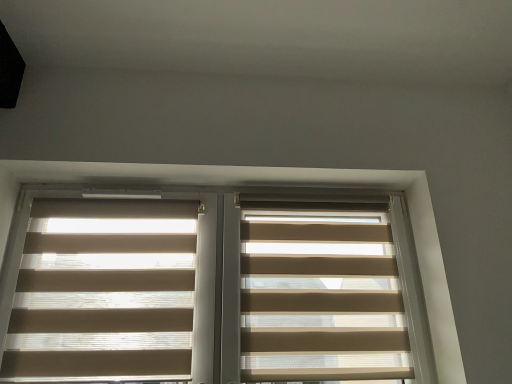
The width and height of the screenshot is (512, 384). What do you see at coordinates (103, 292) in the screenshot?
I see `beige translucent blinds at left, positioned as the 1th window blind in left-to-right order` at bounding box center [103, 292].

This screenshot has height=384, width=512. I want to click on beige translucent blinds at left, acting as the second window blind starting from the right, so click(103, 292).

Describe the element at coordinates (320, 294) in the screenshot. I see `beige fabric blinds at center, marked as the 2th window blind in a left-to-right arrangement` at that location.

This screenshot has width=512, height=384. Describe the element at coordinates (210, 288) in the screenshot. I see `beige translucent blinds at center` at that location.

At what (x,y) coordinates should I click in order to perform the action: click on beige translucent blinds at left, positioned as the 1th window blind in left-to-right order. Please return your answer as a coordinate pair (x, y). Image resolution: width=512 pixels, height=384 pixels. Looking at the image, I should click on (103, 292).

Consider the image. Is beige translucent blinds at left, positioned as the 1th window blind in left-to-right order, taller than beige translucent blinds at center?

No, beige translucent blinds at left, positioned as the 1th window blind in left-to-right order, is not taller than beige translucent blinds at center.

Can you tell me how much beige translucent blinds at left, positioned as the 1th window blind in left-to-right order, and beige translucent blinds at center differ in facing direction?

The facing directions of beige translucent blinds at left, positioned as the 1th window blind in left-to-right order, and beige translucent blinds at center are 1.68 degrees apart.

The width and height of the screenshot is (512, 384). What are the coordinates of `window blind that is the 1st one when counting downward from the beige translucent blinds at center (from the image's perspective)` in the screenshot? It's located at (103, 292).

Looking at their sizes, would you say beige translucent blinds at left, acting as the second window blind starting from the right, is wider or thinner than beige translucent blinds at center?

In the image, beige translucent blinds at left, acting as the second window blind starting from the right, appears to be more narrow than beige translucent blinds at center.

Is beige translucent blinds at left, positioned as the 1th window blind in left-to-right order, closer to camera compared to beige fabric blinds at center, marked as the 2th window blind in a left-to-right arrangement?

Yes, beige translucent blinds at left, positioned as the 1th window blind in left-to-right order, is closer to the viewer.

Is point (188, 252) more distant than point (365, 228)?

No, it is in front of (365, 228).

Based on the photo, what's the angular difference between beige translucent blinds at left, acting as the second window blind starting from the right, and beige fabric blinds at center, the first window blind in the right-to-left sequence,'s facing directions?

They differ by 0.00105 degrees in their facing directions.

Which is more to the left, beige translucent blinds at left, acting as the second window blind starting from the right, or beige fabric blinds at center, the first window blind in the right-to-left sequence?

beige translucent blinds at left, acting as the second window blind starting from the right, is more to the left.

Looking at their sizes, would you say beige translucent blinds at center is wider or thinner than beige fabric blinds at center, the first window blind in the right-to-left sequence?

beige translucent blinds at center is wider than beige fabric blinds at center, the first window blind in the right-to-left sequence.

Would you say beige translucent blinds at center contains beige fabric blinds at center, the first window blind in the right-to-left sequence?

That's correct, beige fabric blinds at center, the first window blind in the right-to-left sequence, is inside beige translucent blinds at center.

Are beige translucent blinds at center and beige fabric blinds at center, the first window blind in the right-to-left sequence, beside each other?

beige translucent blinds at center and beige fabric blinds at center, the first window blind in the right-to-left sequence, are clearly separated.

Which object is positioned more to the right, beige translucent blinds at center or beige fabric blinds at center, the first window blind in the right-to-left sequence?

beige fabric blinds at center, the first window blind in the right-to-left sequence, is more to the right.

Between point (385, 303) and point (86, 326), which one is positioned behind?

The point (385, 303) is behind.

Is beige translucent blinds at left, positioned as the 1th window blind in left-to-right order, located within beige fabric blinds at center, the first window blind in the right-to-left sequence?

That's incorrect, beige translucent blinds at left, positioned as the 1th window blind in left-to-right order, is not inside beige fabric blinds at center, the first window blind in the right-to-left sequence.

From the image's perspective, which object appears higher, beige fabric blinds at center, the first window blind in the right-to-left sequence, or beige translucent blinds at left, positioned as the 1th window blind in left-to-right order?

beige translucent blinds at left, positioned as the 1th window blind in left-to-right order, appears higher in the image.

Considering the positions of objects beige translucent blinds at center and beige translucent blinds at left, positioned as the 1th window blind in left-to-right order, in the image provided, who is behind, beige translucent blinds at center or beige translucent blinds at left, positioned as the 1th window blind in left-to-right order,?

beige translucent blinds at left, positioned as the 1th window blind in left-to-right order.

Which is correct: beige translucent blinds at center is inside beige translucent blinds at left, positioned as the 1th window blind in left-to-right order, or outside of it?

beige translucent blinds at center is outside beige translucent blinds at left, positioned as the 1th window blind in left-to-right order.

Consider the image. How different are the orientations of beige translucent blinds at center and beige translucent blinds at left, positioned as the 1th window blind in left-to-right order, in degrees?

1.68 degrees.

Which object is wider, beige translucent blinds at center or beige translucent blinds at left, positioned as the 1th window blind in left-to-right order?

beige translucent blinds at center is wider.

From the image's perspective, which is above, beige fabric blinds at center, the first window blind in the right-to-left sequence, or beige translucent blinds at center?

beige translucent blinds at center appears higher in the image.

Does beige fabric blinds at center, the first window blind in the right-to-left sequence, have a greater width compared to beige translucent blinds at center?

Incorrect, the width of beige fabric blinds at center, the first window blind in the right-to-left sequence, does not surpass that of beige translucent blinds at center.

Is beige fabric blinds at center, marked as the 2th window blind in a left-to-right arrangement, smaller than beige translucent blinds at center?

Indeed, beige fabric blinds at center, marked as the 2th window blind in a left-to-right arrangement, has a smaller size compared to beige translucent blinds at center.

Does beige fabric blinds at center, marked as the 2th window blind in a left-to-right arrangement, touch beige translucent blinds at center?

No, beige fabric blinds at center, marked as the 2th window blind in a left-to-right arrangement, is not with beige translucent blinds at center.

At what (x,y) coordinates should I click in order to perform the action: click on window blind that is the 1st object located below the beige translucent blinds at center (from the image's perspective). Please return your answer as a coordinate pair (x, y). Image resolution: width=512 pixels, height=384 pixels. Looking at the image, I should click on (103, 292).

You are a GUI agent. You are given a task and a screenshot of the screen. Output one action in this format:
    pyautogui.click(x=<x>, y=<y>)
    Task: Click on the window blind that is on the left side of beige fabric blinds at center, marked as the 2th window blind in a left-to-right arrangement
    The height and width of the screenshot is (384, 512).
    Given the screenshot: What is the action you would take?
    pyautogui.click(x=103, y=292)

Which object lies further to the anchor point beige translucent blinds at left, positioned as the 1th window blind in left-to-right order, beige fabric blinds at center, marked as the 2th window blind in a left-to-right arrangement, or beige translucent blinds at center?

beige fabric blinds at center, marked as the 2th window blind in a left-to-right arrangement, is positioned further to the anchor beige translucent blinds at left, positioned as the 1th window blind in left-to-right order.

When comparing their distances from beige fabric blinds at center, the first window blind in the right-to-left sequence, does beige translucent blinds at left, positioned as the 1th window blind in left-to-right order, or beige translucent blinds at center seem closer?

beige translucent blinds at center is closer to beige fabric blinds at center, the first window blind in the right-to-left sequence.

When comparing their distances from beige fabric blinds at center, the first window blind in the right-to-left sequence, does beige translucent blinds at center or beige translucent blinds at left, positioned as the 1th window blind in left-to-right order, seem further?

beige translucent blinds at left, positioned as the 1th window blind in left-to-right order, lies further to beige fabric blinds at center, the first window blind in the right-to-left sequence, than the other object.

Looking at the image, which one is located closer to beige translucent blinds at center, beige fabric blinds at center, marked as the 2th window blind in a left-to-right arrangement, or beige translucent blinds at left, acting as the second window blind starting from the right?

Among the two, beige translucent blinds at left, acting as the second window blind starting from the right, is located nearer to beige translucent blinds at center.

Which object lies nearer to the anchor point beige translucent blinds at center, beige translucent blinds at left, positioned as the 1th window blind in left-to-right order, or beige fabric blinds at center, marked as the 2th window blind in a left-to-right arrangement?

beige translucent blinds at left, positioned as the 1th window blind in left-to-right order, is positioned closer to the anchor beige translucent blinds at center.

Which object lies nearer to the anchor point beige translucent blinds at left, acting as the second window blind starting from the right, beige translucent blinds at center or beige fabric blinds at center, the first window blind in the right-to-left sequence?

beige translucent blinds at center.

You are a GUI agent. You are given a task and a screenshot of the screen. Output one action in this format:
    pyautogui.click(x=<x>, y=<y>)
    Task: Click on the window between beige translucent blinds at left, positioned as the 1th window blind in left-to-right order, and beige fabric blinds at center, marked as the 2th window blind in a left-to-right arrangement, in the horizontal direction
    This screenshot has height=384, width=512.
    Given the screenshot: What is the action you would take?
    pyautogui.click(x=210, y=288)